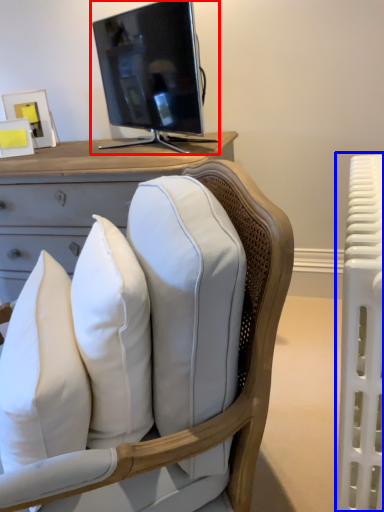
Question: Among these objects, which one is farthest to the camera, television (highlighted by a red box) or radiator (highlighted by a blue box)?

Choices:
 (A) television
 (B) radiator

Answer: (A)